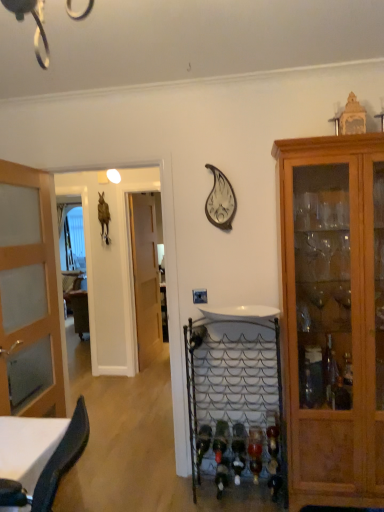
Question: Looking at the image, does metallic wire wine rack at center seem bigger or smaller compared to green glass wine bottle at lower center, which is counted as the first wine bottle, starting from the top?

Choices:
 (A) big
 (B) small

Answer: (A)

Question: From the image's perspective, is metallic wire wine rack at center positioned above or below green glass wine bottle at lower center, which is counted as the first wine bottle, starting from the top?

Choices:
 (A) below
 (B) above

Answer: (B)

Question: Which of these objects is positioned closest to the wooden door at center, marked as the 1th door in a right-to-left arrangement?

Choices:
 (A) translucent wood door at left, marked as the 1th door in a front-to-back arrangement
 (B) metallic silver clock at upper center
 (C) green glass wine bottle at lower center, which is counted as the second wine bottle, starting from the right
 (D) metallic wire wine rack at center
 (E) wooden cabinet at right

Answer: (A)

Question: Considering the real-world distances, which object is farthest from the green glass wine bottle at lower center, which is counted as the second wine bottle, starting from the right?

Choices:
 (A) translucent wood door at left, which is the first door from left to right
 (B) translucent glass wine bottle at lower center, placed as the 1th wine bottle when sorted from bottom to top
 (C) wooden cabinet at right
 (D) metallic wire wine rack at center
 (E) metallic silver clock at upper center

Answer: (A)